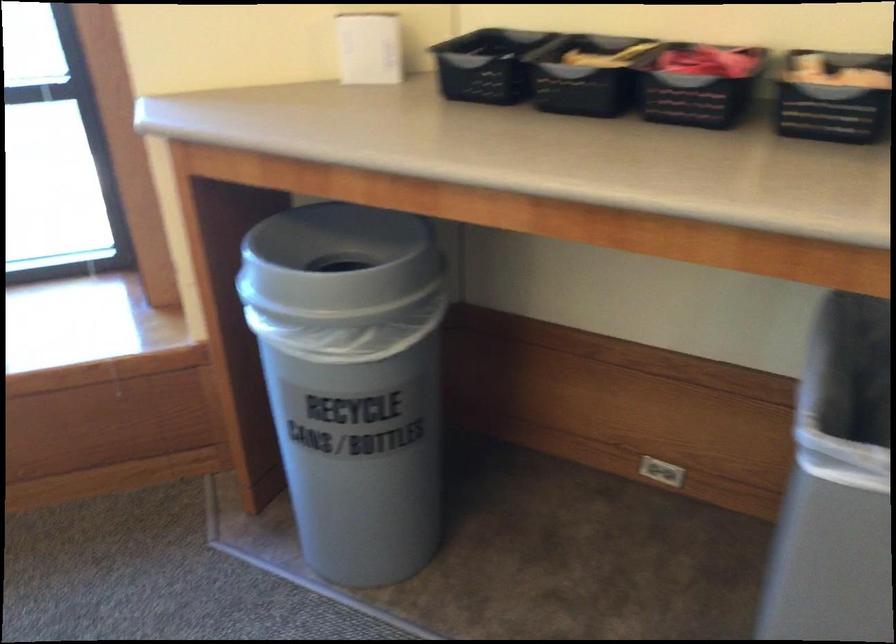
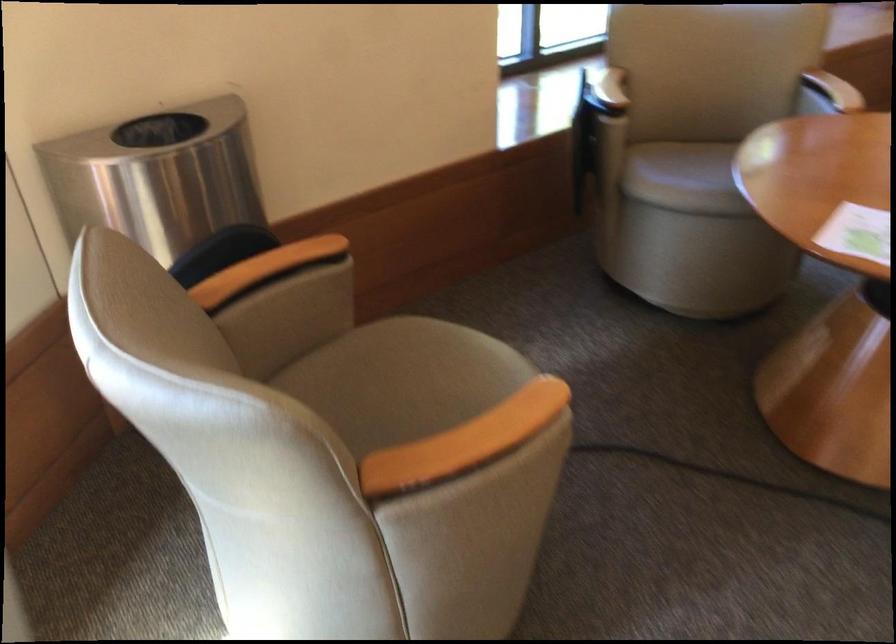
Question: The images are taken continuously from a first-person perspective. In which direction are you moving?

Choices:
 (A) Left
 (B) Right
 (C) Forward
 (D) Backward

Answer: (A)